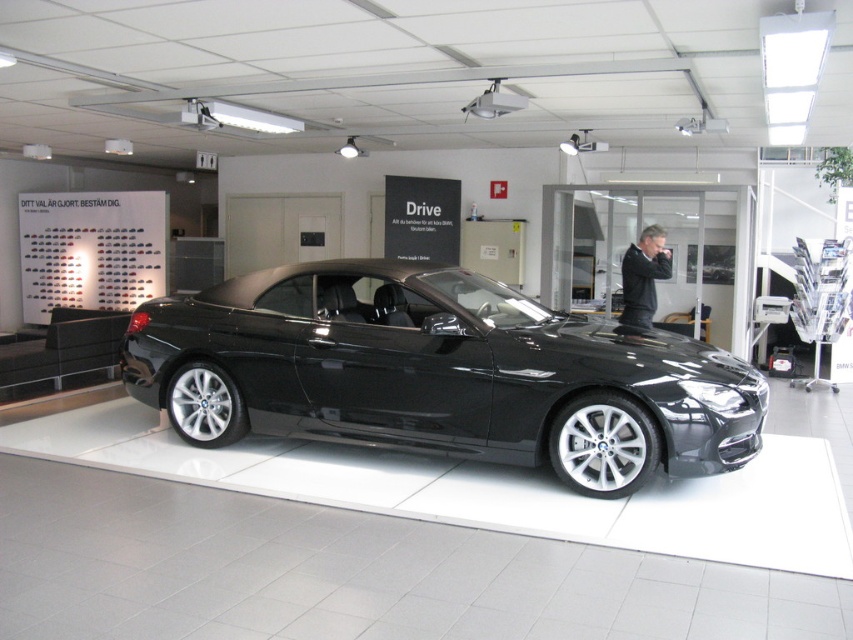
Which is behind, point (529, 358) or point (643, 314)?

Positioned behind is point (643, 314).

How distant is glossy black convertible at center from black leather jacket at center?

glossy black convertible at center is 2.02 meters from black leather jacket at center.

Is point (160, 330) positioned before point (624, 276)?

Yes.

The image size is (853, 640). Find the location of `glossy black convertible at center`. glossy black convertible at center is located at coordinates (440, 372).